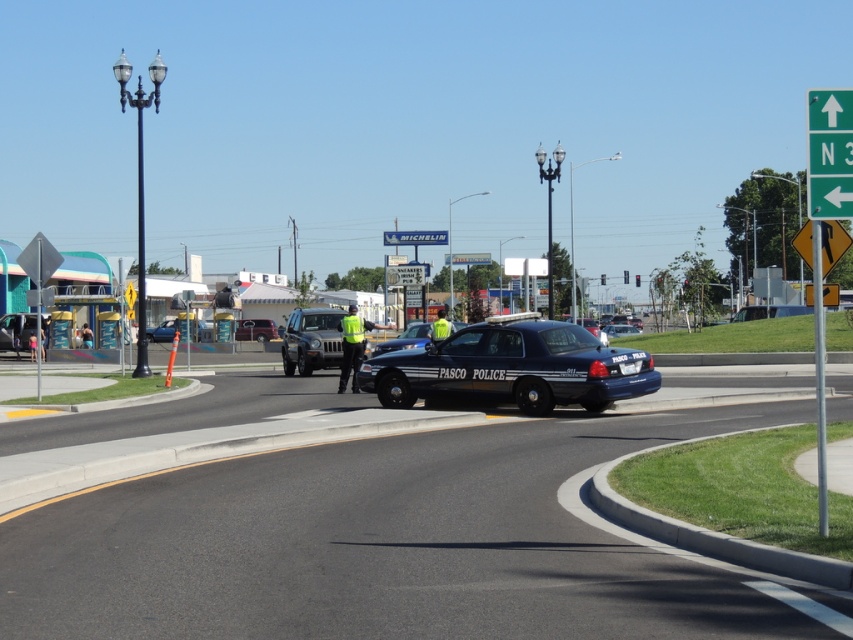
You are a pedestrian standing at the edge of the roundabout intersection. You see a reflective yellow vest at center. Where is the reflective yellow vest located relative to the point marked by coordinates (x=352, y=344)?

The reflective yellow vest at center is located exactly at the point marked by coordinates (x=352, y=344).

You are a pedestrian standing at the edge of the roundabout and want to cross to the other side. The glossy blue police car at center is blocking your path. Can you safely walk around it without entering the road? Please provide a clear yes or no and explain your reasoning.

The glossy blue police car at center is 20.40 meters away from you. Since the car is blocking your path, you would need to walk around it, but given the distance, it is likely safe to walk around it without entering the road. However, always ensure you are in a designated pedestrian area for safety.